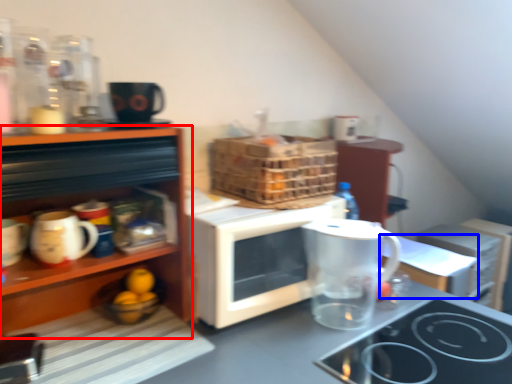
Question: Which point is further to the camera, cabinetry (highlighted by a red box) or table (highlighted by a blue box)?

Choices:
 (A) cabinetry
 (B) table

Answer: (B)